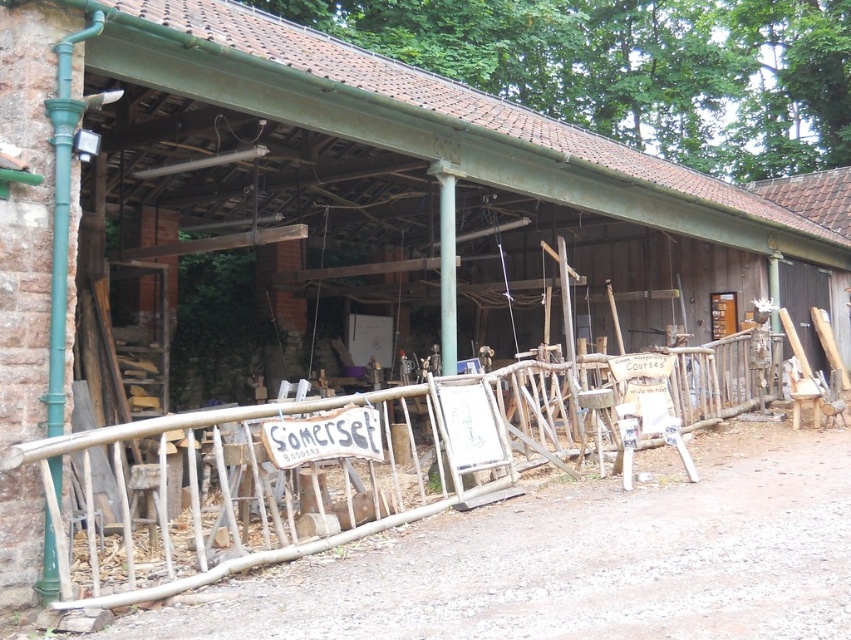
Can you confirm if wooden at center is thinner than wooden signboard at center?

In fact, wooden at center might be wider than wooden signboard at center.

Can you confirm if wooden at center is wider than wooden signboard at center?

Yes.

The image size is (851, 640). Describe the element at coordinates (373, 461) in the screenshot. I see `wooden at center` at that location.

Identify the location of wooden at center. (373, 461).